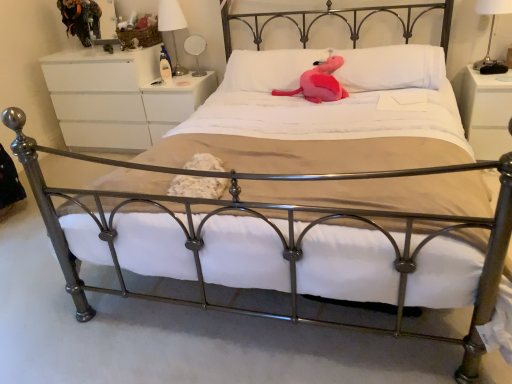
Question: From a real-world perspective, is white matte dresser at upper left, which is the first nightstand in left-to-right order, positioned under white glossy lampshade at upper center, acting as the 1th bedside lamp starting from the back, based on gravity?

Choices:
 (A) yes
 (B) no

Answer: (A)

Question: Considering the relative sizes of white matte dresser at upper left, which is the first nightstand in left-to-right order, and white glossy lampshade at upper center, acting as the 1th bedside lamp starting from the back, in the image provided, is white matte dresser at upper left, which is the first nightstand in left-to-right order, taller than white glossy lampshade at upper center, acting as the 1th bedside lamp starting from the back,?

Choices:
 (A) no
 (B) yes

Answer: (B)

Question: Is white matte dresser at upper left, which is the first nightstand in left-to-right order, at the left side of white glossy lampshade at upper center, arranged as the first bedside lamp when viewed from the left?

Choices:
 (A) no
 (B) yes

Answer: (B)

Question: From the image's perspective, would you say white matte dresser at upper left, positioned as the 3th nightstand in right-to-left order, is shown under white glossy lampshade at upper center, placed as the 2th bedside lamp when sorted from front to back?

Choices:
 (A) yes
 (B) no

Answer: (A)

Question: Considering the relative sizes of white matte dresser at upper left, which is the first nightstand in left-to-right order, and white glossy lampshade at upper center, arranged as the first bedside lamp when viewed from the left, in the image provided, is white matte dresser at upper left, which is the first nightstand in left-to-right order, smaller than white glossy lampshade at upper center, arranged as the first bedside lamp when viewed from the left,?

Choices:
 (A) no
 (B) yes

Answer: (A)

Question: Is white glossy nightstand at right, which appears as the third nightstand when viewed from the left, spatially inside white glossy nightstand at center, which is counted as the second nightstand, starting from the left, or outside of it?

Choices:
 (A) inside
 (B) outside

Answer: (B)

Question: Does point (484, 76) appear closer or farther from the camera than point (182, 104)?

Choices:
 (A) farther
 (B) closer

Answer: (B)

Question: In terms of height, does white glossy nightstand at right, which is counted as the first nightstand, starting from the right, look taller or shorter compared to white glossy nightstand at center, which is counted as the 2th nightstand, starting from the right?

Choices:
 (A) short
 (B) tall

Answer: (B)

Question: Is white glossy nightstand at right, which is counted as the first nightstand, starting from the right, wider or thinner than white glossy nightstand at center, which is counted as the second nightstand, starting from the left?

Choices:
 (A) wide
 (B) thin

Answer: (A)

Question: From the image's perspective, is pink plush at center, the first pillow from the left, located above or below white glossy nightstand at center, which is counted as the second nightstand, starting from the left?

Choices:
 (A) above
 (B) below

Answer: (A)

Question: Considering the relative positions of pink plush at center, the 2th pillow viewed from the right, and white glossy nightstand at center, which is counted as the 2th nightstand, starting from the right, in the image provided, is pink plush at center, the 2th pillow viewed from the right, to the left or to the right of white glossy nightstand at center, which is counted as the 2th nightstand, starting from the right,?

Choices:
 (A) left
 (B) right

Answer: (B)

Question: Is pink plush at center, the 2th pillow viewed from the right, taller or shorter than white glossy nightstand at center, which is counted as the 2th nightstand, starting from the right?

Choices:
 (A) short
 (B) tall

Answer: (A)

Question: Considering the positions of pink plush at center, the first pillow from the left, and white glossy nightstand at center, which is counted as the second nightstand, starting from the left, in the image, is pink plush at center, the first pillow from the left, bigger or smaller than white glossy nightstand at center, which is counted as the second nightstand, starting from the left,?

Choices:
 (A) big
 (B) small

Answer: (B)

Question: From their relative heights in the image, would you say white glossy lampshade at upper center, acting as the 1th bedside lamp starting from the back, is taller or shorter than pink plush at center, the 1th pillow from the right?

Choices:
 (A) tall
 (B) short

Answer: (A)

Question: Would you say white glossy lampshade at upper center, placed as the second bedside lamp when sorted from right to left, is to the left or to the right of pink plush at center, placed as the second pillow when sorted from left to right, in the picture?

Choices:
 (A) left
 (B) right

Answer: (A)